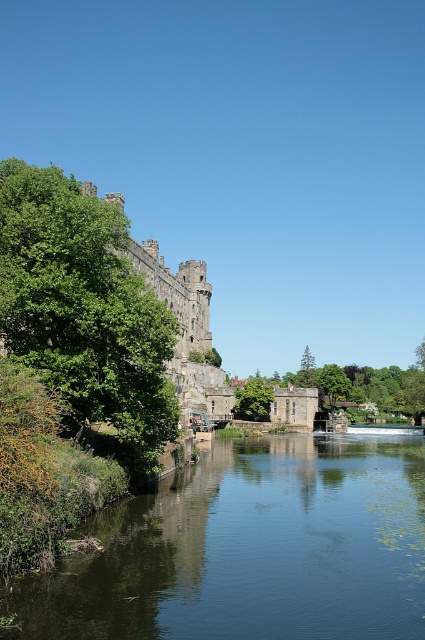
Looking at this image, you are planning to build a small wooden bridge over the dark blue water at center. The bridge needs to be as wide as the green leafy tree at left. Is the bridge wide enough to span the water?

The dark blue water at center might be wider than green leafy tree at left, so the bridge may not be wide enough to span the water.

You are a visitor standing in front of the castle and see the green leafy tree at left and the green leafy tree at center. Which tree is located more to the left?

The green leafy tree at left is positioned on the left side of green leafy tree at center, so it is more to the left.